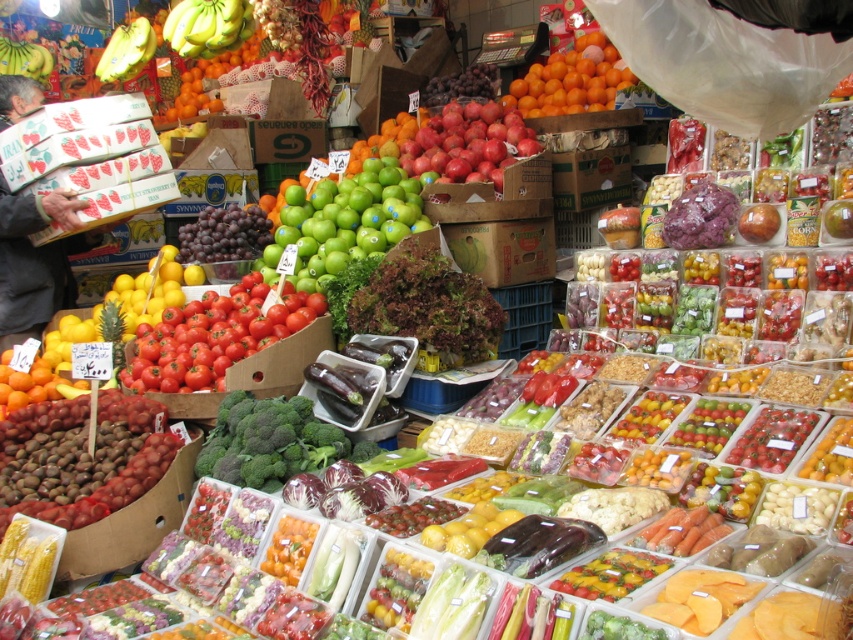
You are a customer at the market and want to find the green matte apples at center. According to the stall layout, where exactly are they located?

The green matte apples at center are located at the coordinates point (344, 221).

You are a customer at the market and want to pick up the shiny red apples at center. However, there is a box blocking your view. Can you reach them without moving the green matte apples at center?

The green matte apples at center are in front of the shiny red apples at center, so you would need to move the green matte apples at center to access the shiny red apples at center.